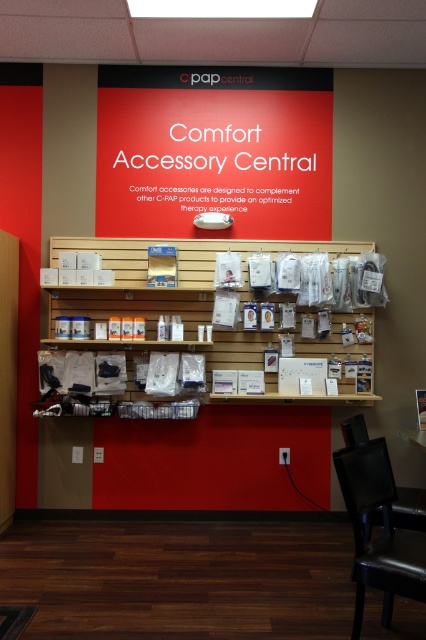
Is point (75, 301) positioned before point (400, 500)?

No, it is behind (400, 500).

Is wooden shelf at center to the right of black leather chair at lower right from the viewer's perspective?

Incorrect, wooden shelf at center is not on the right side of black leather chair at lower right.

Where is `wooden shelf at center`? wooden shelf at center is located at coordinates (201, 317).

Is red matte signboard at upper center further to camera compared to black leather swivel chair at lower right?

Yes, it is.

This screenshot has height=640, width=426. Identify the location of red matte signboard at upper center. (213, 150).

Does red matte signboard at upper center come in front of matte plastic bottles at center?

No, it is behind matte plastic bottles at center.

Does red matte signboard at upper center have a greater height compared to matte plastic bottles at center?

Yes.

Is point (160, 81) in front of point (106, 307)?

No, it is not.

The image size is (426, 640). In order to click on red matte signboard at upper center in this screenshot , I will do `click(213, 150)`.